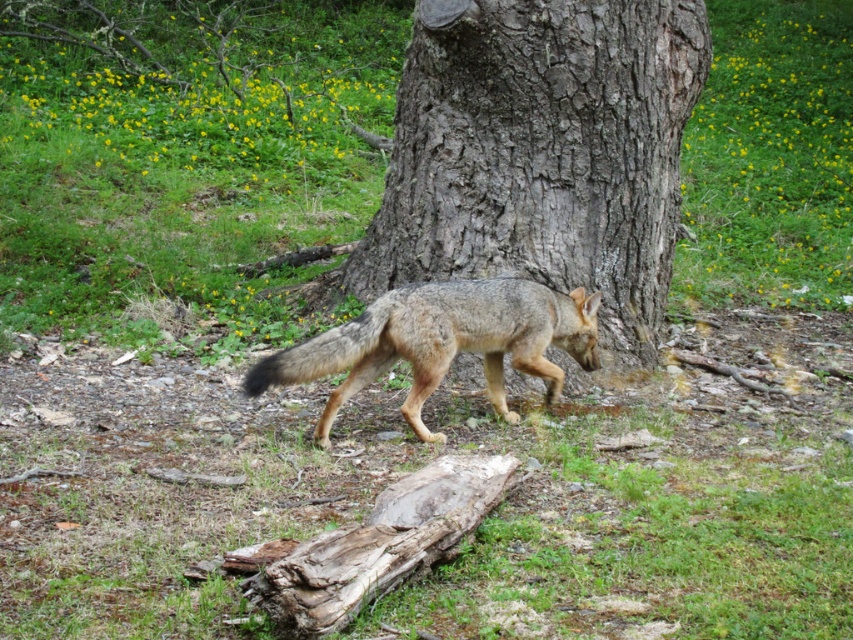
You are a photographer trying to capture the gray bark tree at center in your shot. The camera you are using has a fixed focus point at coordinate 0.244 on the x axis and 0.632 on the y axis. Will the tree be in focus?

Yes, the gray bark tree at center is located exactly at the camera focus point coordinates of 0.244 on the x axis and 0.632 on the y axis, so it will be in focus.